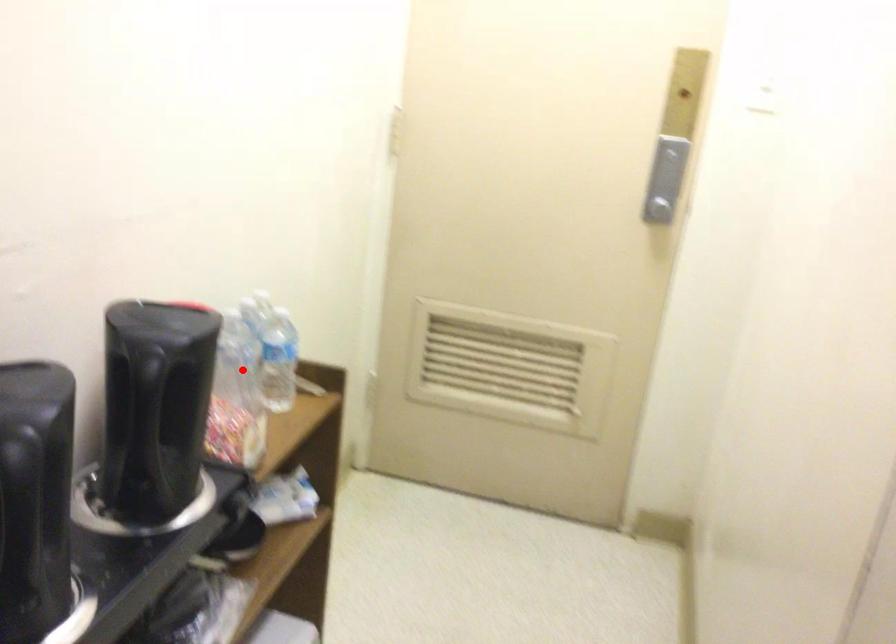
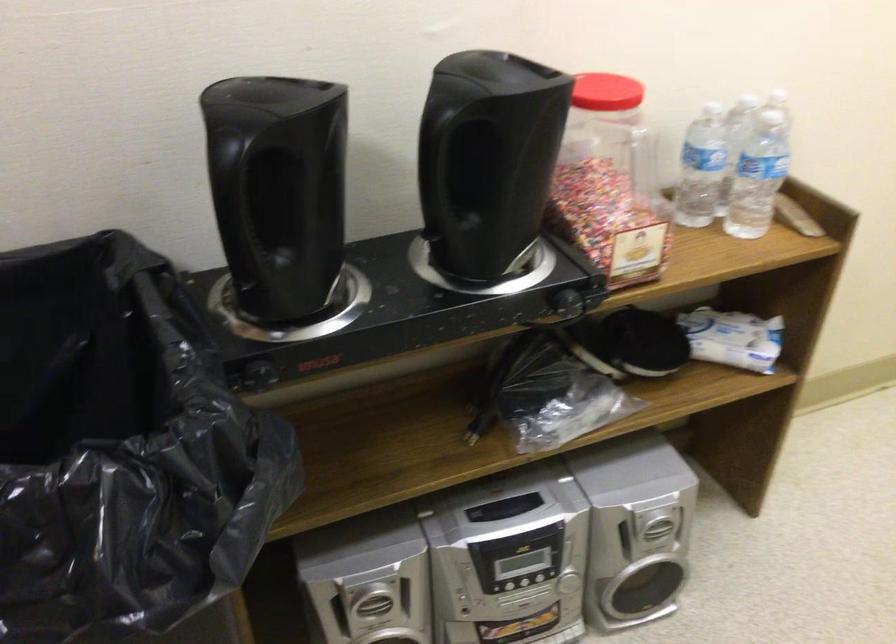
In the second image, find the point that corresponds to the highlighted location in the first image.

(701, 167)